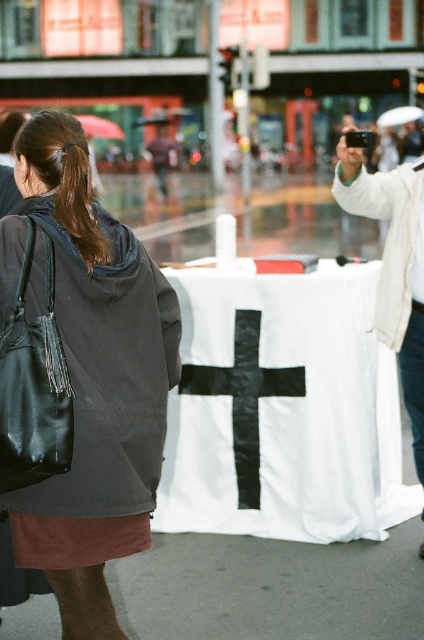
Is point (362, 205) less distant than point (92, 240)?

No, (362, 205) is further to viewer.

Does white matte phone at upper right appear over brown shiny hair at left?

No.

This screenshot has height=640, width=424. What are the coordinates of `white matte phone at upper right` in the screenshot? It's located at (393, 266).

The image size is (424, 640). Find the location of `white matte phone at upper right`. white matte phone at upper right is located at coordinates (393, 266).

Does point (78, 369) lie in front of point (387, 310)?

Yes, point (78, 369) is in front of point (387, 310).

Can you confirm if black leather jacket at left is wider than white matte phone at upper right?

Yes, black leather jacket at left is wider than white matte phone at upper right.

This screenshot has width=424, height=640. Describe the element at coordinates (89, 374) in the screenshot. I see `black leather jacket at left` at that location.

Image resolution: width=424 pixels, height=640 pixels. I want to click on black leather jacket at left, so click(x=89, y=374).

Which is more to the left, black leather jacket at left or brown shiny hair at left?

From the viewer's perspective, brown shiny hair at left appears more on the left side.

Does black leather jacket at left have a smaller size compared to brown shiny hair at left?

No, black leather jacket at left is not smaller than brown shiny hair at left.

Locate an element on the screen. This screenshot has width=424, height=640. black leather jacket at left is located at coordinates (89, 374).